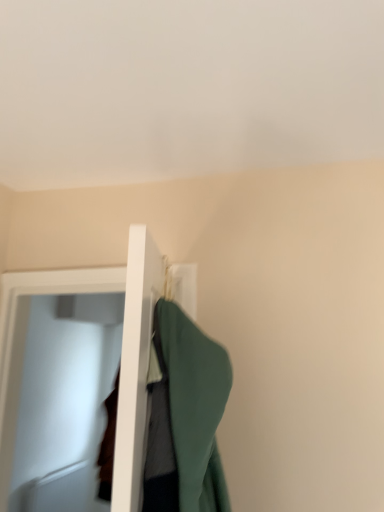
Locate an element on the screen. white glossy screen door at left is located at coordinates (58, 401).

The width and height of the screenshot is (384, 512). Describe the element at coordinates (58, 401) in the screenshot. I see `white glossy screen door at left` at that location.

This screenshot has height=512, width=384. In order to click on white glossy screen door at left in this screenshot , I will do `click(58, 401)`.